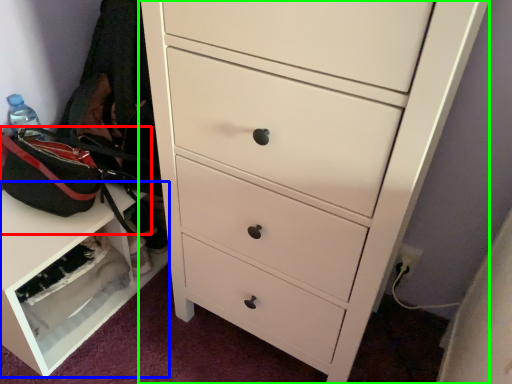
Question: Which object is the closest to the messenger bag (highlighted by a red box)? Choose among these: cabinetry (highlighted by a blue box) or chest of drawers (highlighted by a green box).

Choices:
 (A) cabinetry
 (B) chest of drawers

Answer: (A)